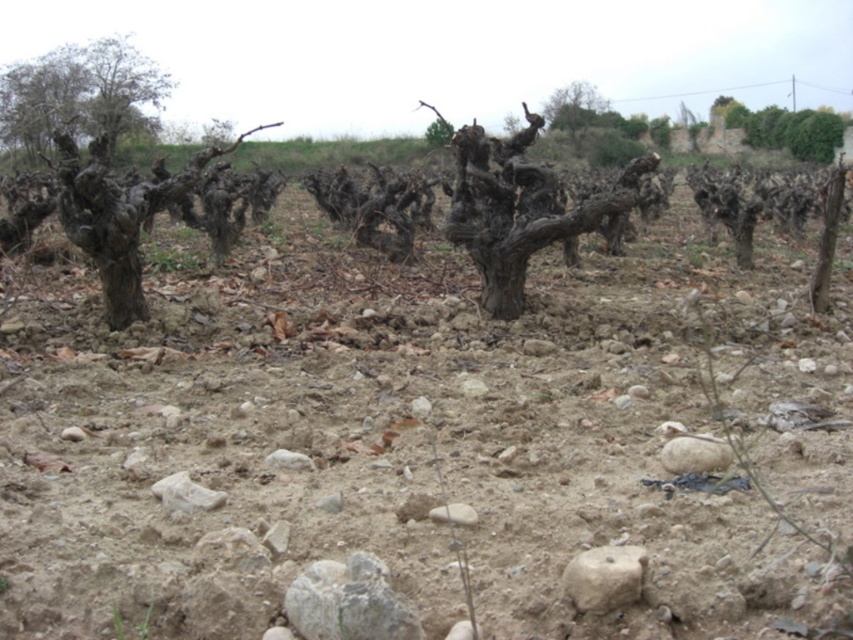
Question: Can you confirm if gray rough bark tree at center is thinner than brown rough tree trunk at upper left?

Choices:
 (A) no
 (B) yes

Answer: (B)

Question: Can you confirm if dark brown bark tree at left is positioned to the left of gray rough bark tree at center?

Choices:
 (A) yes
 (B) no

Answer: (A)

Question: Which of the following is the farthest from the observer?

Choices:
 (A) white smooth rock at center
 (B) brown rough tree trunk at upper left

Answer: (B)

Question: Estimate the real-world distances between objects in this image. Which object is farther from the brown rough tree trunk at upper left?

Choices:
 (A) gray rough rock at center
 (B) green leafy bush at upper right

Answer: (A)

Question: Which point is closer to the camera?

Choices:
 (A) dark brown bark tree at left
 (B) gray rough bark tree at center

Answer: (A)

Question: Observing the image, what is the correct spatial positioning of gray rough bark tree at center in reference to brown rough tree trunk at upper left?

Choices:
 (A) below
 (B) above

Answer: (B)